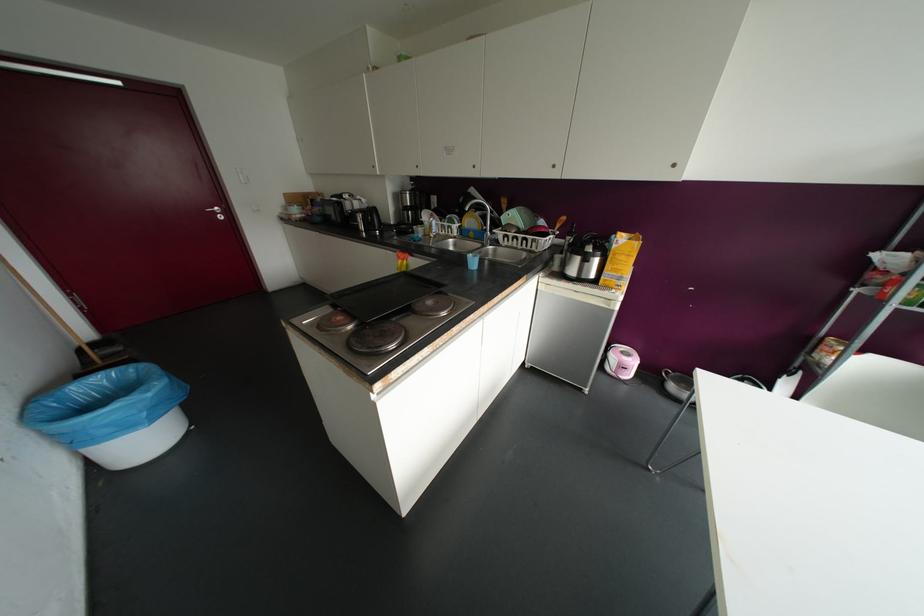
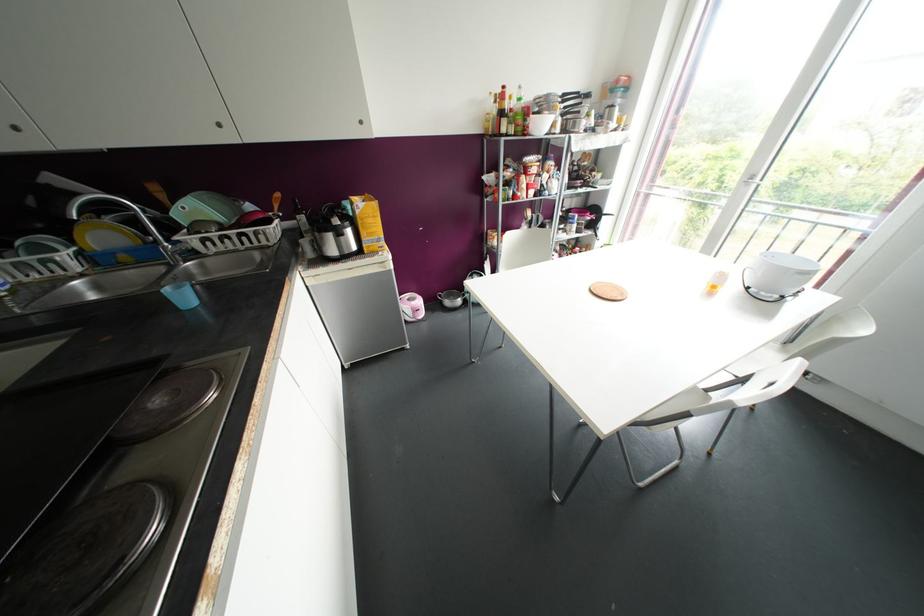
The point at (624, 358) is marked in the first image. Where is the corresponding point in the second image?

(412, 302)